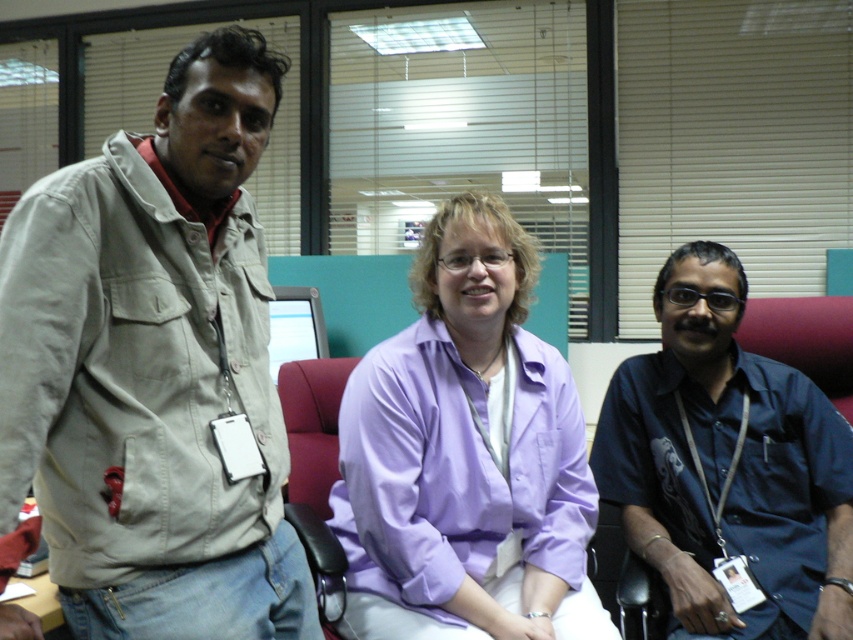
You are organizing a clothing donation drive and need to decide which items can fit into a narrow storage box. The beige cotton jacket at left and the dark blue shirt at center are both candidates. Based on their thickness, which one is more likely to fit into the box?

The beige cotton jacket at left is thinner than the dark blue shirt at center, so it is more likely to fit into the narrow storage box.

You are standing in the office scene and want to place a small decoration between the two points, point (18, 312) and point (740, 262). Which point should the decoration be closer to in order to be nearer to the viewer?

The decoration should be placed closer to point (18, 312) because it is closer to the viewer than point (740, 262).